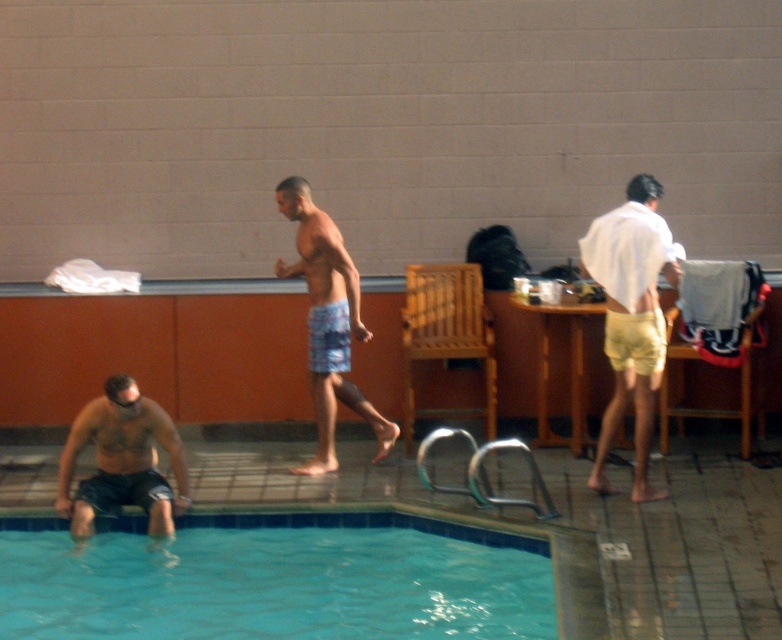
You are a lifeguard assessing the pool area. You notice the blue glossy water at lower left and the matte black shorts at lower left. Which object is closer to the water surface?

The blue glossy water at lower left has a lesser height compared to matte black shorts at lower left, meaning the blue glossy water at lower left is closer to the water surface.

You are standing at the center of the indoor pool area and see a point marked at coordinates (327,323). Which object does this point lie on?

The point at (327,323) lies on the blue printed shorts at center.